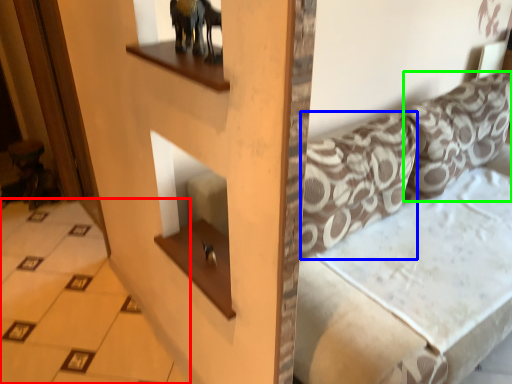
Question: Considering the real-world distances, which object is closest to tile (highlighted by a red box)? pillow (highlighted by a blue box) or pillow (highlighted by a green box).

Choices:
 (A) pillow
 (B) pillow

Answer: (A)